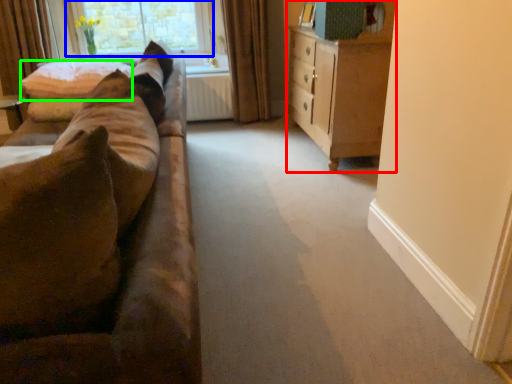
Question: Based on their relative distances, which object is farther from cabinetry (highlighted by a red box)? Choose from window (highlighted by a blue box) and pillow (highlighted by a green box).

Choices:
 (A) window
 (B) pillow

Answer: (A)